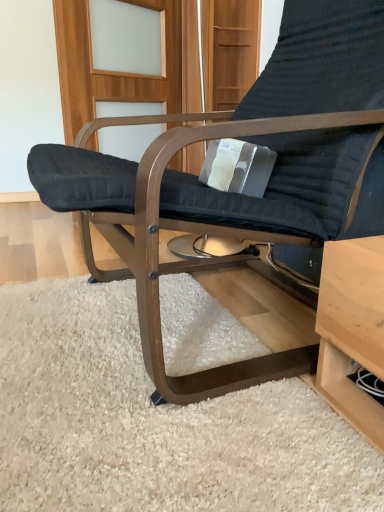
Locate an element on the screen. The image size is (384, 512). wooden armchair at center is located at coordinates coord(235,193).

What do you see at coordinates (235, 193) in the screenshot? The height and width of the screenshot is (512, 384). I see `wooden armchair at center` at bounding box center [235, 193].

At what (x,y) coordinates should I click in order to perform the action: click on wooden armchair at center. Please return your answer as a coordinate pair (x, y). This screenshot has width=384, height=512. Looking at the image, I should click on (235, 193).